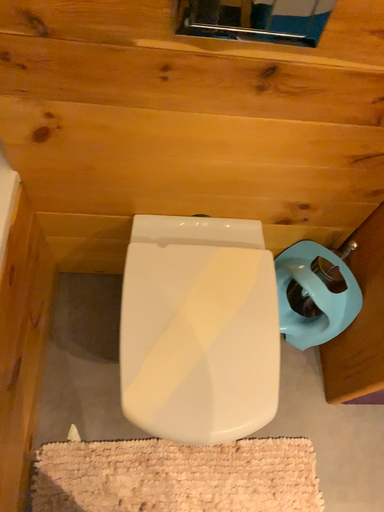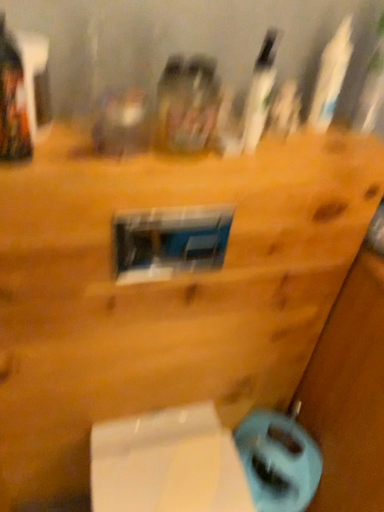
Question: How did the camera likely rotate when shooting the video?

Choices:
 (A) rotated left
 (B) rotated right

Answer: (B)